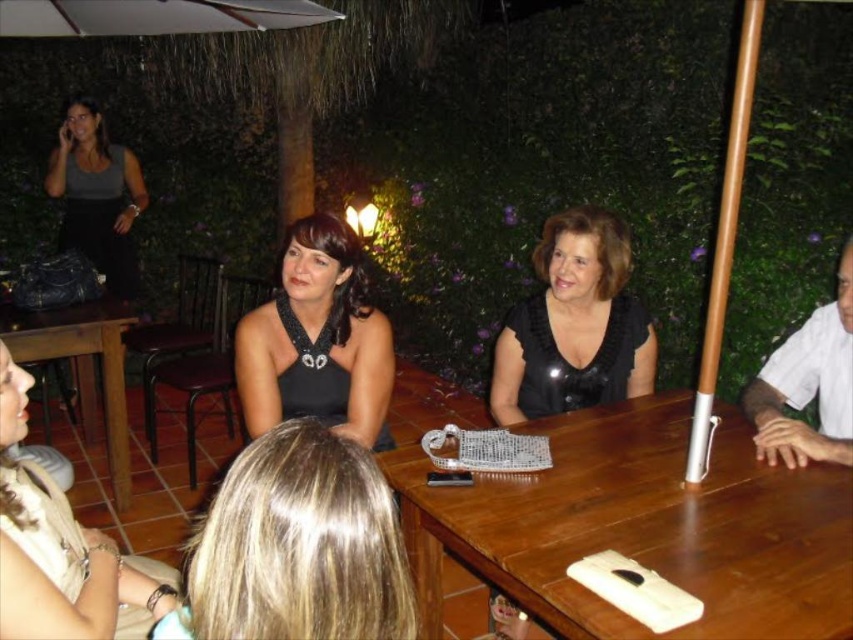
Does black satin dress at center appear on the right side of brown wooden table at lower left?

Indeed, black satin dress at center is positioned on the right side of brown wooden table at lower left.

Between black satin dress at center and brown wooden table at lower left, which one is positioned lower?

brown wooden table at lower left is below.

Is point (370, 433) farther from camera compared to point (90, 410)?

No.

At what (x,y) coordinates should I click in order to perform the action: click on black satin dress at center. Please return your answer as a coordinate pair (x, y). This screenshot has width=853, height=640. Looking at the image, I should click on (317, 340).

Measure the distance between black satin blouse at center and camera.

They are 2.12 meters apart.

Who is more distant from viewer, (573,262) or (809,348)?

Point (573,262)

What do you see at coordinates (573, 324) in the screenshot? I see `black satin blouse at center` at bounding box center [573, 324].

Locate an element on the screen. Image resolution: width=853 pixels, height=640 pixels. black satin blouse at center is located at coordinates (573, 324).

You are a GUI agent. You are given a task and a screenshot of the screen. Output one action in this format:
    pyautogui.click(x=<x>, y=<y>)
    Task: Click on the blonde hair at lower center
    Image resolution: width=853 pixels, height=640 pixels.
    Given the screenshot: What is the action you would take?
    pyautogui.click(x=296, y=547)

Who is lower down, blonde hair at lower center or black satin blouse at center?

Positioned lower is blonde hair at lower center.

Who is more forward, (x=219, y=579) or (x=520, y=394)?

Point (x=219, y=579) is in front.

Image resolution: width=853 pixels, height=640 pixels. Find the location of `blonde hair at lower center`. blonde hair at lower center is located at coordinates (296, 547).